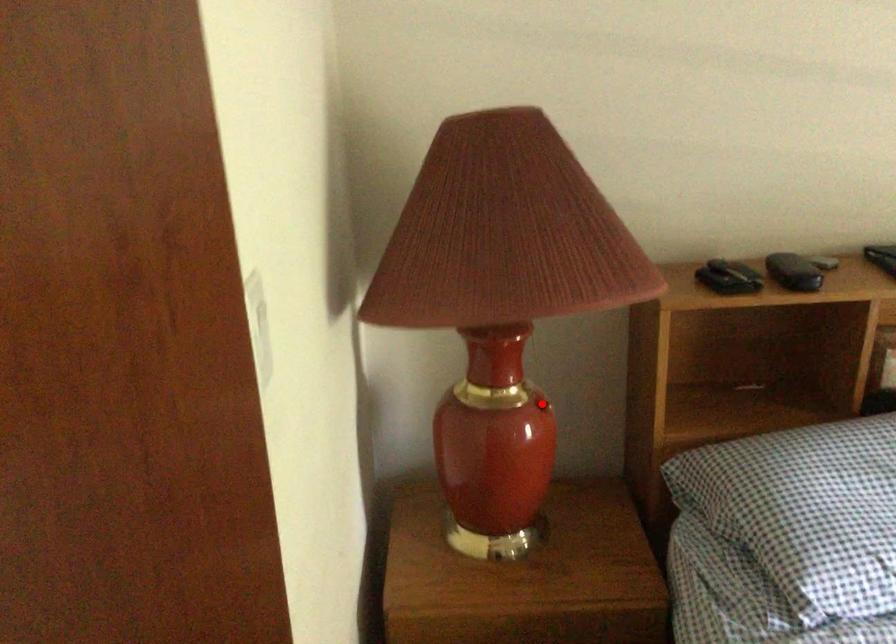
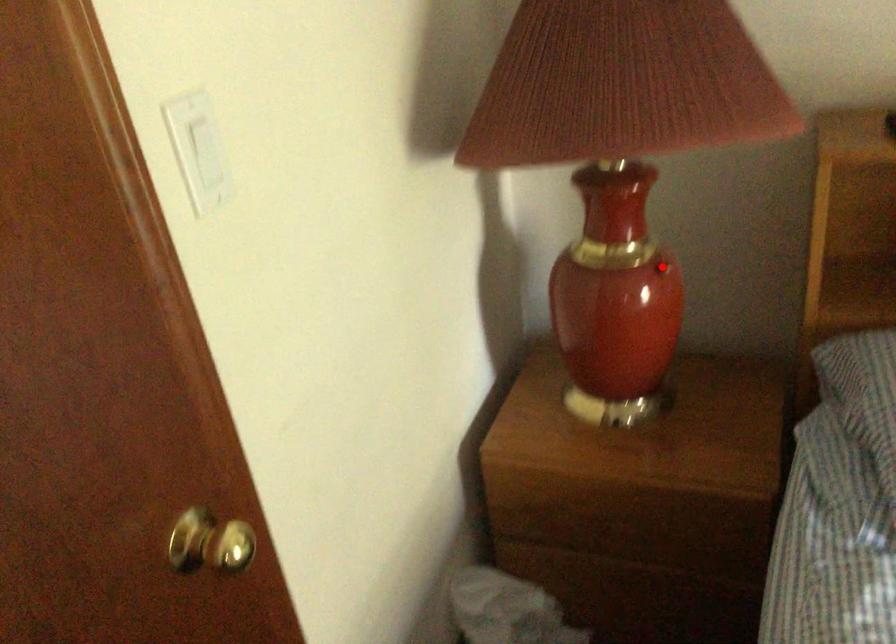
I am providing you with two images of the same scene from different viewpoints. A red point is marked on the first image and another point is marked on the second image. Is the marked point in image1 the same physical position as the marked point in image2?

Yes